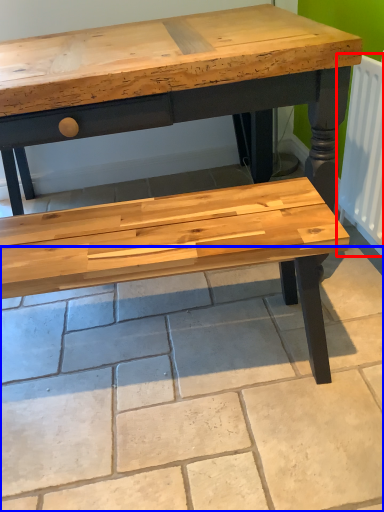
Question: Among these objects, which one is nearest to the camera, radiator (highlighted by a red box) or tile (highlighted by a blue box)?

Choices:
 (A) radiator
 (B) tile

Answer: (B)